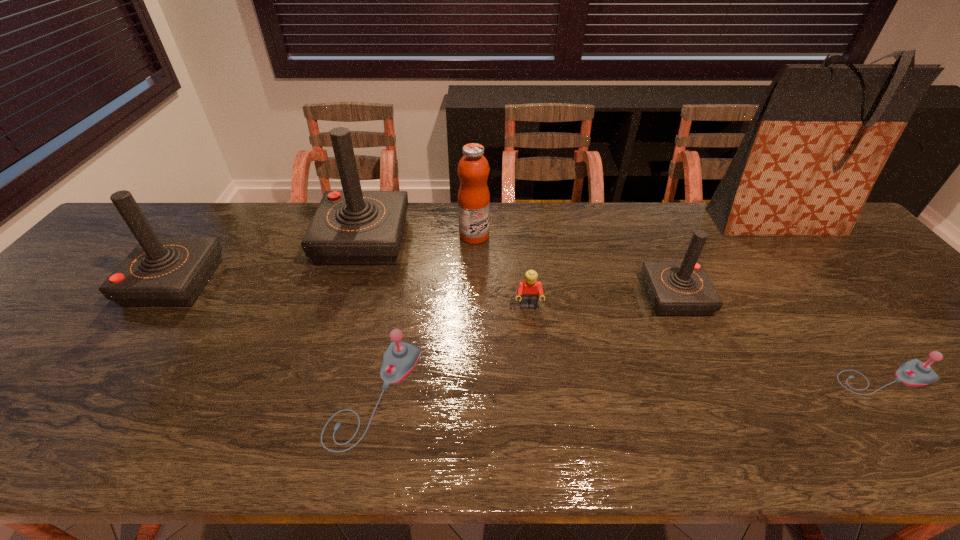
The height and width of the screenshot is (540, 960). I want to click on free space between the second tallest joystick and the second tallest object, so click(x=269, y=261).

You are a GUI agent. You are given a task and a screenshot of the screen. Output one action in this format:
    pyautogui.click(x=<x>, y=<y>)
    Task: Click on the vacant area that lies between the second tallest joystick and the fourth object from right to left
    The width and height of the screenshot is (960, 540).
    Given the screenshot: What is the action you would take?
    pyautogui.click(x=351, y=294)

Where is `vacant area between the leftmost joystick and the tallest object`? The width and height of the screenshot is (960, 540). vacant area between the leftmost joystick and the tallest object is located at coordinates (475, 253).

Locate which object ranks third in proximity to the Lego. Please provide its 2D coordinates. Your answer should be formatted as a tuple, i.e. [(x, y)], where the tuple contains the x and y coordinates of a point satisfying the conditions above.

[(683, 288)]

Identify which object is the nearest to the fourth object from right to left. Please provide its 2D coordinates. Your answer should be formatted as a tuple, i.e. [(x, y)], where the tuple contains the x and y coordinates of a point satisfying the conditions above.

[(473, 169)]

The height and width of the screenshot is (540, 960). What are the coordinates of `joystick object that ranks as the fifth closest to the fruit juice` in the screenshot? It's located at (914, 372).

In order to click on joystick object that ranks as the fourth closest to the shopping bag in this screenshot , I will do `click(351, 227)`.

Where is `the third closest red joystick to the right gray joystick`? the third closest red joystick to the right gray joystick is located at coordinates (160, 271).

At what (x,y) coordinates should I click in order to perform the action: click on red joystick that is the second closest to the Lego. Please return your answer as a coordinate pair (x, y). Looking at the image, I should click on (351, 227).

Locate an element on the screen. Image resolution: width=960 pixels, height=540 pixels. vacant region that satisfies the following two spatial constraints: 1. on the rectangular base of the right gray joystick; 2. on the left side of the smallest red joystick is located at coordinates (712, 379).